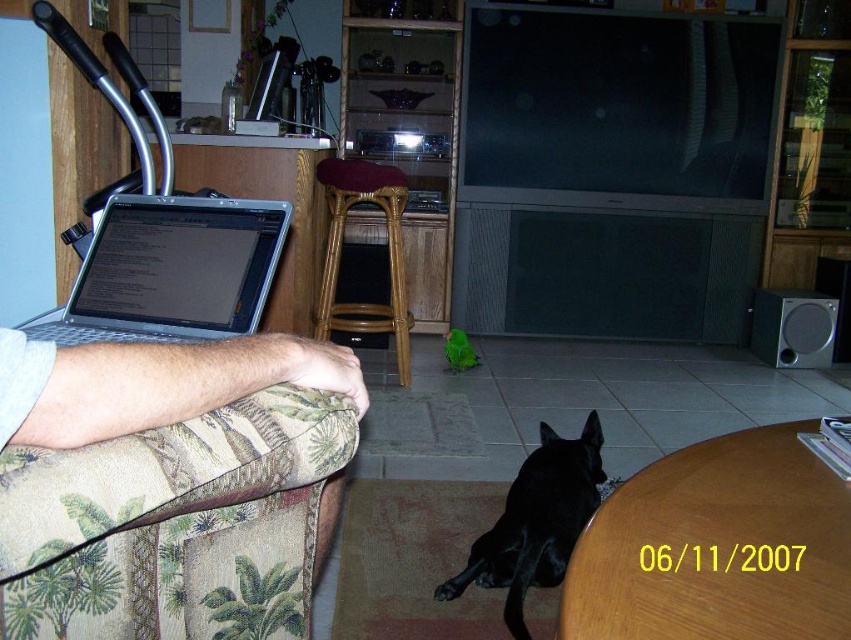
Question: Is brown wooden table at lower right further to camera compared to black glossy dog at lower center?

Choices:
 (A) yes
 (B) no

Answer: (B)

Question: From the image, what is the correct spatial relationship of light skin toneskinhand at lower left in relation to black glossy dog at lower center?

Choices:
 (A) above
 (B) below

Answer: (A)

Question: From the image, what is the correct spatial relationship of green fabric couch at lower left in relation to brown wooden table at lower right?

Choices:
 (A) right
 (B) left

Answer: (B)

Question: Which point is closer to the camera taking this photo?

Choices:
 (A) (842, 516)
 (B) (193, 248)
 (C) (337, 250)
 (D) (89, 356)

Answer: (D)

Question: Which of the following is the closest to the observer?

Choices:
 (A) green fabric couch at lower left
 (B) brown wooden table at lower right
 (C) light skin toneskinhand at lower left

Answer: (C)

Question: Which object is farther from the camera taking this photo?

Choices:
 (A) black glossy dog at lower center
 (B) silver metallic laptop at upper left
 (C) green fabric couch at lower left

Answer: (A)